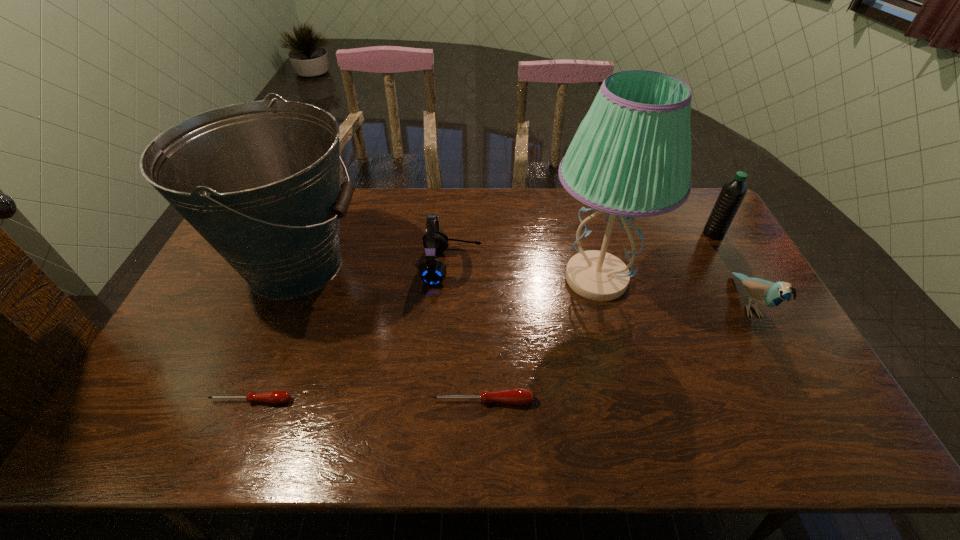
What are the coordinates of `water bottle located at the right edge` in the screenshot? It's located at (733, 192).

This screenshot has height=540, width=960. In order to click on bird that is positioned at the right edge in this screenshot , I will do `click(766, 293)`.

I want to click on object that is at the far left corner, so click(x=260, y=181).

The width and height of the screenshot is (960, 540). I want to click on object that is at the far right corner, so click(733, 192).

The height and width of the screenshot is (540, 960). Identify the location of vacant space at the far edge of the desktop. (418, 212).

Find the location of a particular element. vacant point at the near edge is located at coordinates (755, 406).

You are a GUI agent. You are given a task and a screenshot of the screen. Output one action in this format:
    pyautogui.click(x=<x>, y=<y>)
    Task: Click on the free space at the near right corner
    The image size is (960, 540).
    Given the screenshot: What is the action you would take?
    pyautogui.click(x=801, y=399)

At what (x,y) coordinates should I click in order to perform the action: click on vacant area that lies between the water bottle and the shortest object. Please return your answer as a coordinate pair (x, y). The height and width of the screenshot is (540, 960). Looking at the image, I should click on (482, 317).

You are a GUI agent. You are given a task and a screenshot of the screen. Output one action in this format:
    pyautogui.click(x=<x>, y=<y>)
    Task: Click on the unoccupied area between the right screwdriver and the bucket
    The height and width of the screenshot is (540, 960).
    Given the screenshot: What is the action you would take?
    pyautogui.click(x=389, y=333)

Find the location of a particular element. The image size is (960, 540). blank region between the bucket and the headset is located at coordinates (373, 265).